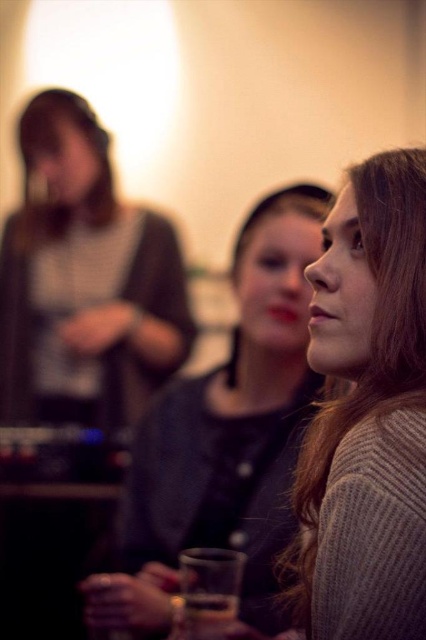
This screenshot has width=426, height=640. Describe the element at coordinates (368, 412) in the screenshot. I see `knit sweater at center` at that location.

Is point (371, 179) in front of point (227, 596)?

That is True.

Is point (422, 323) more distant than point (227, 620)?

No, (422, 323) is closer to viewer.

Locate an element on the screen. knit sweater at center is located at coordinates (368, 412).

Is knit sweater at center further to camera compared to smooth gray sweater at center?

That is False.

Which is below, knit sweater at center or smooth gray sweater at center?

smooth gray sweater at center

Is point (389, 477) more distant than point (308, 372)?

No.

Locate an element on the screen. knit sweater at center is located at coordinates (368, 412).

Image resolution: width=426 pixels, height=640 pixels. In order to click on smooth gray sweater at center in this screenshot , I will do `click(224, 436)`.

Does point (258, 264) come behind point (184, 614)?

Yes, point (258, 264) is farther from viewer.

This screenshot has height=640, width=426. Find the location of `smooth gray sweater at center`. smooth gray sweater at center is located at coordinates (224, 436).